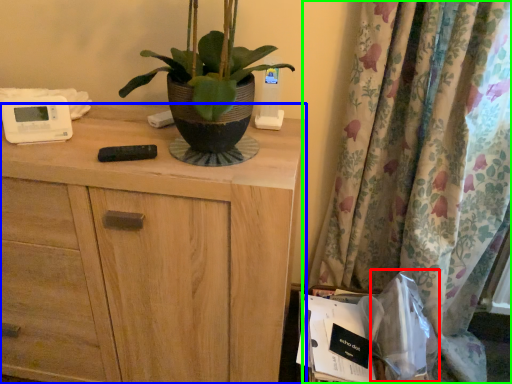
Question: Estimate the real-world distances between objects in this image. Which object is closer to paper bag (highlighted by a red box), chest of drawers (highlighted by a blue box) or curtain (highlighted by a green box)?

Choices:
 (A) chest of drawers
 (B) curtain

Answer: (B)